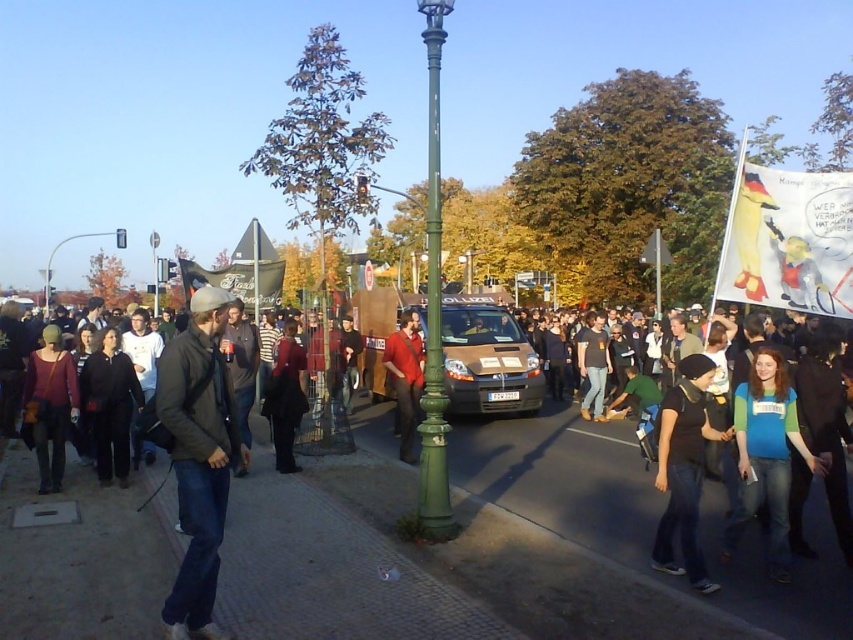
Which is behind, point (297, 419) or point (44, 305)?

Positioned behind is point (44, 305).

Identify the location of dark red fabric coat at center. The width and height of the screenshot is (853, 640). (285, 396).

Who is higher up, green painted metal pole at center or metallic pole at upper left?

Positioned higher is green painted metal pole at center.

Is green painted metal pole at center taller than metallic pole at upper left?

Correct, green painted metal pole at center is much taller as metallic pole at upper left.

Who is more distant from viewer, (419,486) or (117,246)?

The point (117,246) is behind.

Where is `green painted metal pole at center`? green painted metal pole at center is located at coordinates (433, 305).

Does dark gray jacket at center have a larger size compared to blue-green t-shirt at center-right?

Yes, dark gray jacket at center is bigger than blue-green t-shirt at center-right.

How far apart are dark gray jacket at center and blue-green t-shirt at center-right?

They are 3.93 meters apart.

At what (x,y) coordinates should I click in order to perform the action: click on dark gray jacket at center. Please return your answer as a coordinate pair (x, y). The width and height of the screenshot is (853, 640). Looking at the image, I should click on (198, 456).